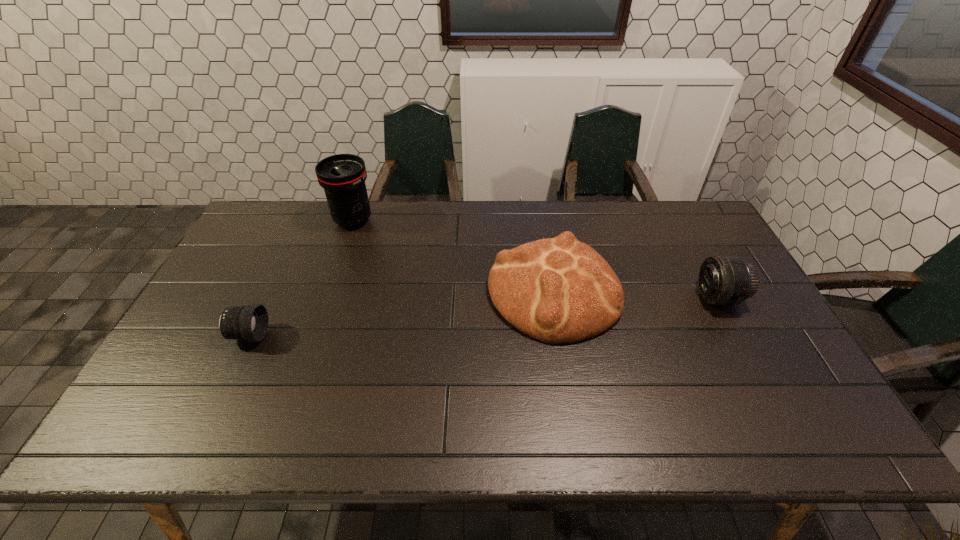
Image resolution: width=960 pixels, height=540 pixels. Find the location of `object that can be found as the second closest to the second tallest telephoto lens`. object that can be found as the second closest to the second tallest telephoto lens is located at coordinates (343, 176).

Select which object is the second closest to the bread. Please provide its 2D coordinates. Your answer should be formatted as a tuple, i.e. [(x, y)], where the tuple contains the x and y coordinates of a point satisfying the conditions above.

[(343, 176)]

Identify which telephoto lens is located as the third nearest to the second object from right to left. Please provide its 2D coordinates. Your answer should be formatted as a tuple, i.e. [(x, y)], where the tuple contains the x and y coordinates of a point satisfying the conditions above.

[(250, 323)]

Point out which telephoto lens is positioned as the third nearest to the third object from left to right. Please provide its 2D coordinates. Your answer should be formatted as a tuple, i.e. [(x, y)], where the tuple contains the x and y coordinates of a point satisfying the conditions above.

[(250, 323)]

Find the location of a particular element. vacant region that satisfies the following two spatial constraints: 1. on the front side of the tallest object; 2. on the right side of the bread is located at coordinates (328, 292).